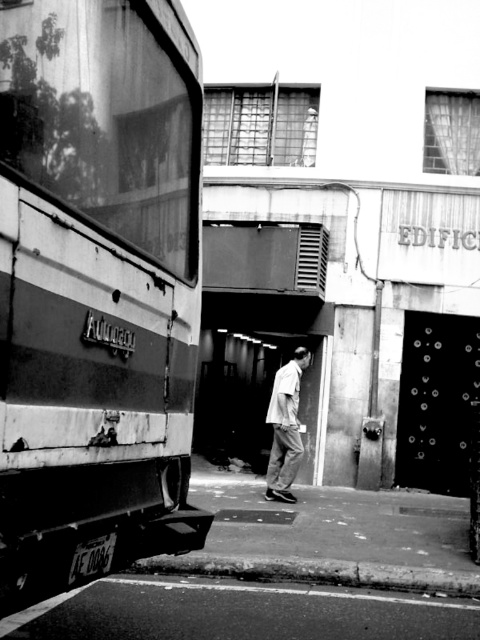
Question: Considering the relative positions of rusty metal train car at left and light gray cotton shirt at center in the image provided, where is rusty metal train car at left located with respect to light gray cotton shirt at center?

Choices:
 (A) left
 (B) right

Answer: (A)

Question: Does smooth asphalt train track at lower left have a larger size compared to light gray cotton shirt at center?

Choices:
 (A) no
 (B) yes

Answer: (B)

Question: Which point is farther from the camera taking this photo?

Choices:
 (A) (195, 212)
 (B) (290, 360)
 (C) (371, 592)

Answer: (B)

Question: Considering the relative positions of rusty metal train car at left and light gray cotton shirt at center in the image provided, where is rusty metal train car at left located with respect to light gray cotton shirt at center?

Choices:
 (A) right
 (B) left

Answer: (B)

Question: Estimate the real-world distances between objects in this image. Which object is closer to the rusty metal train car at left?

Choices:
 (A) light gray cotton shirt at center
 (B) smooth asphalt train track at lower left

Answer: (B)

Question: Estimate the real-world distances between objects in this image. Which object is closer to the rusty metal train car at left?

Choices:
 (A) light gray cotton shirt at center
 (B) smooth asphalt train track at lower left

Answer: (B)